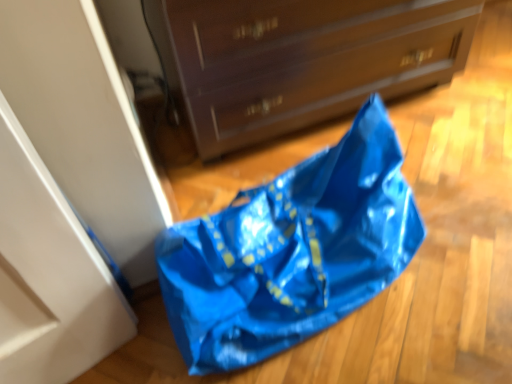
Question: Does matte brown chest of drawers at center have a greater width compared to blue plastic bag at lower center?

Choices:
 (A) no
 (B) yes

Answer: (B)

Question: Can you confirm if matte brown chest of drawers at center is smaller than blue plastic bag at lower center?

Choices:
 (A) yes
 (B) no

Answer: (B)

Question: Considering the relative sizes of matte brown chest of drawers at center and blue plastic bag at lower center in the image provided, is matte brown chest of drawers at center bigger than blue plastic bag at lower center?

Choices:
 (A) yes
 (B) no

Answer: (A)

Question: Considering the relative sizes of matte brown chest of drawers at center and blue plastic bag at lower center in the image provided, is matte brown chest of drawers at center taller than blue plastic bag at lower center?

Choices:
 (A) no
 (B) yes

Answer: (B)

Question: Considering the relative positions of matte brown chest of drawers at center and blue plastic bag at lower center in the image provided, is matte brown chest of drawers at center to the left of blue plastic bag at lower center from the viewer's perspective?

Choices:
 (A) yes
 (B) no

Answer: (B)

Question: From the image's perspective, is matte brown chest of drawers at center on top of blue plastic bag at lower center?

Choices:
 (A) no
 (B) yes

Answer: (B)

Question: Can you confirm if blue plastic bag at lower center is bigger than matte brown chest of drawers at center?

Choices:
 (A) yes
 (B) no

Answer: (B)

Question: Is blue plastic bag at lower center to the left of matte brown chest of drawers at center from the viewer's perspective?

Choices:
 (A) no
 (B) yes

Answer: (B)

Question: Are blue plastic bag at lower center and matte brown chest of drawers at center located far from each other?

Choices:
 (A) yes
 (B) no

Answer: (B)

Question: Does blue plastic bag at lower center come in front of matte brown chest of drawers at center?

Choices:
 (A) yes
 (B) no

Answer: (A)

Question: Does blue plastic bag at lower center have a lesser width compared to matte brown chest of drawers at center?

Choices:
 (A) no
 (B) yes

Answer: (B)

Question: Is blue plastic bag at lower center in contact with matte brown chest of drawers at center?

Choices:
 (A) no
 (B) yes

Answer: (A)

Question: In the image, is blue plastic bag at lower center positioned in front of or behind matte brown chest of drawers at center?

Choices:
 (A) behind
 (B) front

Answer: (B)